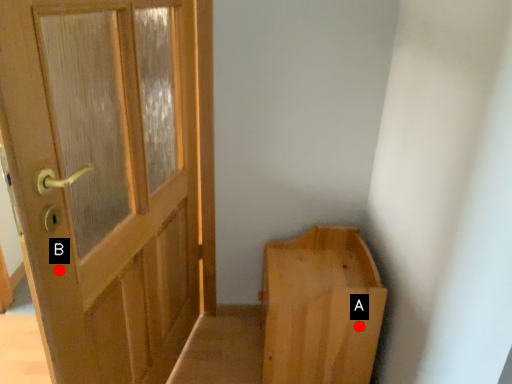
Question: Two points are circled on the image, labeled by A and B beside each circle. Among these points, which one is farthest from the camera?

Choices:
 (A) A is further
 (B) B is further

Answer: (A)